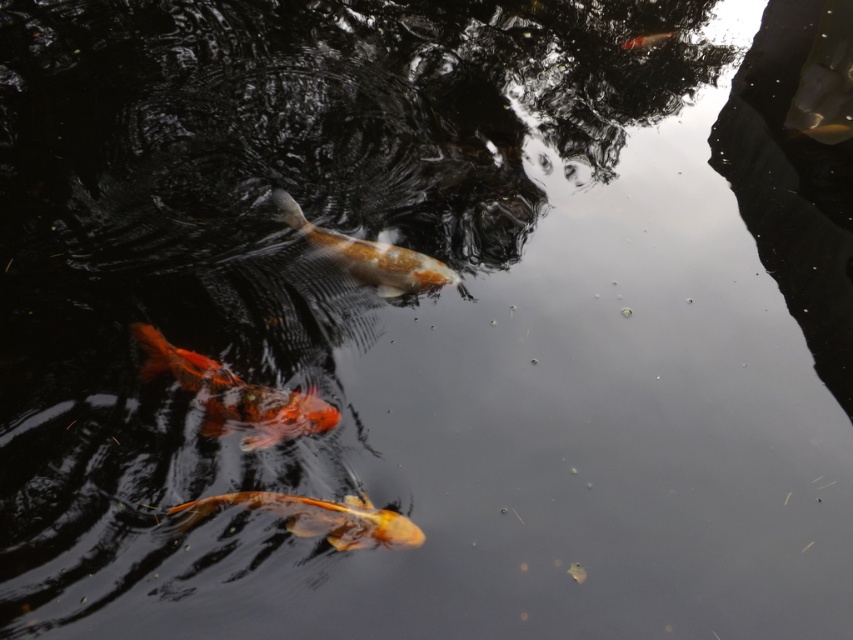
Question: Which object is farther from the camera taking this photo?

Choices:
 (A) shiny orange fish at lower left
 (B) shiny orange goldfish at lower center
 (C) shiny orange fish at upper right

Answer: (C)

Question: Is shiny orange goldfish at lower center to the right of shiny orange fish at center from the viewer's perspective?

Choices:
 (A) yes
 (B) no

Answer: (B)

Question: Does shiny orange fish at lower left appear on the left side of shiny orange fish at upper right?

Choices:
 (A) yes
 (B) no

Answer: (A)

Question: Is shiny orange fish at center positioned at the back of shiny orange fish at upper right?

Choices:
 (A) no
 (B) yes

Answer: (A)

Question: Which point appears farthest from the camera in this image?

Choices:
 (A) (398, 248)
 (B) (653, 44)

Answer: (B)

Question: Which of the following is the farthest from the observer?

Choices:
 (A) shiny orange goldfish at lower center
 (B) shiny orange fish at upper right

Answer: (B)